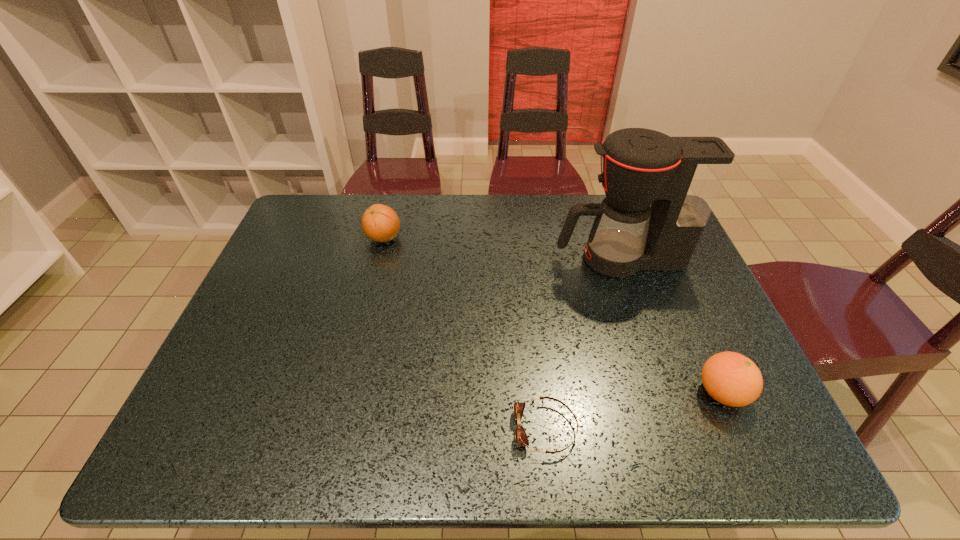
Locate an element on the screen. the tallest object is located at coordinates (681, 177).

Image resolution: width=960 pixels, height=540 pixels. In order to click on the left orange in this screenshot , I will do `click(380, 223)`.

What are the coordinates of `the leftmost object` in the screenshot? It's located at (380, 223).

The height and width of the screenshot is (540, 960). In order to click on the right orange in this screenshot , I will do `click(732, 379)`.

Locate an element on the screen. The image size is (960, 540). the third object from right to left is located at coordinates (521, 438).

Locate an element on the screen. the shortest object is located at coordinates (521, 438).

The height and width of the screenshot is (540, 960). In order to click on free space located pour from the carafe of the tallest object in this screenshot , I will do `click(433, 259)`.

Identify the location of vacant space located pour from the carafe of the tallest object. (450, 259).

The image size is (960, 540). I want to click on vacant space located 0.400m pour from the carafe of the tallest object, so point(420,259).

Locate an element on the screen. Image resolution: width=960 pixels, height=540 pixels. vacant space situated 0.210m on the left of the left orange is located at coordinates (298, 238).